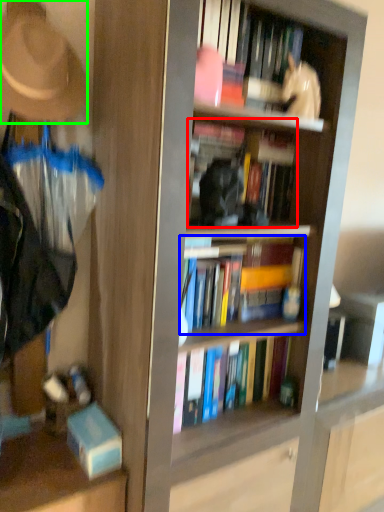
Question: Considering the real-world distances, which object is closest to book (highlighted by a red box)? book (highlighted by a blue box) or hat (highlighted by a green box).

Choices:
 (A) book
 (B) hat

Answer: (A)